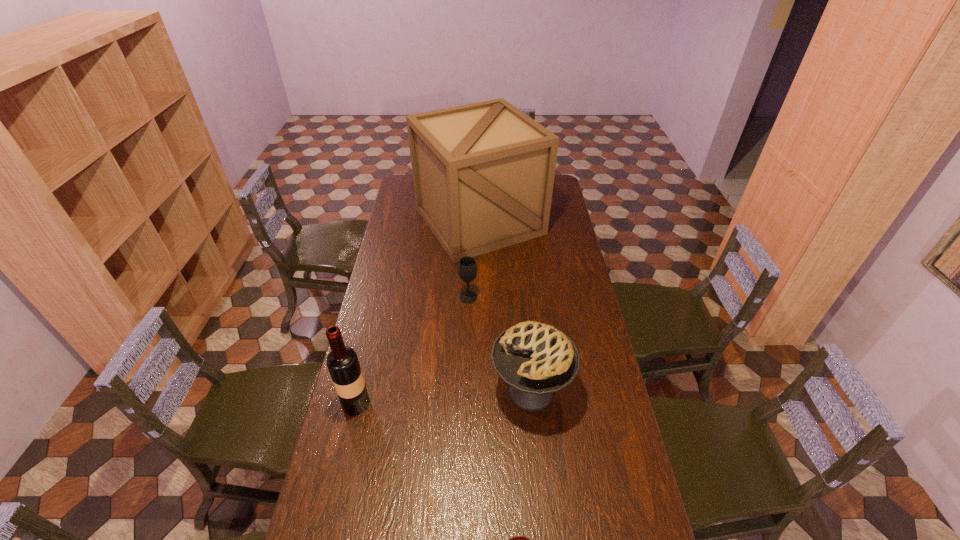
This screenshot has width=960, height=540. Find the location of `free space that satisfies the following two spatial constraints: 1. on the back side of the tallest object; 2. on the right side of the leftmost object`. free space that satisfies the following two spatial constraints: 1. on the back side of the tallest object; 2. on the right side of the leftmost object is located at coordinates (399, 221).